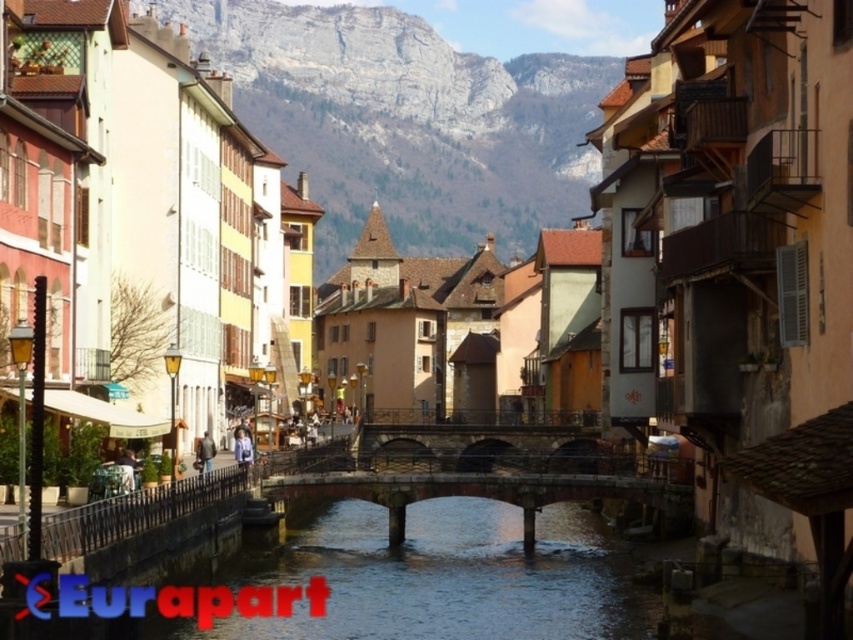
Based on the photo, is stone bridge at center taller than stone arch bridge at center?

Indeed, stone bridge at center has a greater height compared to stone arch bridge at center.

Does stone bridge at center appear under stone arch bridge at center?

Correct, stone bridge at center is located below stone arch bridge at center.

Where is `stone bridge at center`? The image size is (853, 640). stone bridge at center is located at coordinates (489, 493).

Is rocky gray mountain at center wider than stone bridge at center?

Yes.

Does rocky gray mountain at center appear on the left side of stone bridge at center?

Yes, rocky gray mountain at center is to the left of stone bridge at center.

Is point (546, 189) farther from camera compared to point (450, 490)?

Yes, point (546, 189) is farther from viewer.

Find the location of a particular element. rocky gray mountain at center is located at coordinates (405, 120).

Which of these two, rocky gray mountain at center or stone arch bridge at center, stands taller?

rocky gray mountain at center is taller.

This screenshot has width=853, height=640. What do you see at coordinates (405, 120) in the screenshot? I see `rocky gray mountain at center` at bounding box center [405, 120].

Is point (426, 102) positioned after point (558, 426)?

That is True.

This screenshot has width=853, height=640. What are the coordinates of `rocky gray mountain at center` in the screenshot? It's located at coord(405,120).